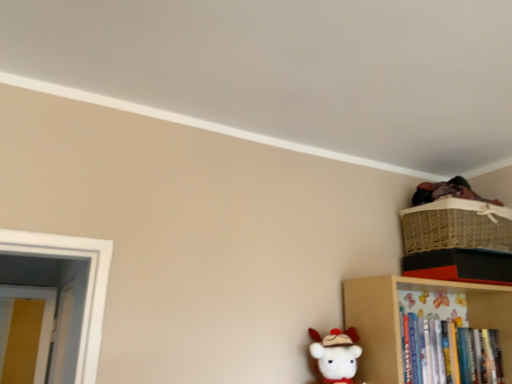
Question: Is woven straw basket at upper right positioned with its back to white plush toy at lower center?

Choices:
 (A) no
 (B) yes

Answer: (A)

Question: Considering the relative sizes of woven straw basket at upper right and white plush toy at lower center in the image provided, is woven straw basket at upper right shorter than white plush toy at lower center?

Choices:
 (A) no
 (B) yes

Answer: (B)

Question: Does woven straw basket at upper right have a smaller size compared to white plush toy at lower center?

Choices:
 (A) yes
 (B) no

Answer: (B)

Question: Can you confirm if woven straw basket at upper right is wider than white plush toy at lower center?

Choices:
 (A) no
 (B) yes

Answer: (B)

Question: From the image's perspective, is woven straw basket at upper right over white plush toy at lower center?

Choices:
 (A) no
 (B) yes

Answer: (B)

Question: Could you tell me if woven straw basket at upper right is turned towards white plush toy at lower center?

Choices:
 (A) yes
 (B) no

Answer: (B)

Question: Could you tell me if wooden bookshelf at lower right is turned towards white plush toy at lower center?

Choices:
 (A) no
 (B) yes

Answer: (A)

Question: Is wooden bookshelf at lower right not close to white plush toy at lower center?

Choices:
 (A) no
 (B) yes

Answer: (A)

Question: Does wooden bookshelf at lower right have a smaller size compared to white plush toy at lower center?

Choices:
 (A) yes
 (B) no

Answer: (B)

Question: From a real-world perspective, is wooden bookshelf at lower right on top of white plush toy at lower center?

Choices:
 (A) yes
 (B) no

Answer: (A)

Question: Does wooden bookshelf at lower right have a larger size compared to white plush toy at lower center?

Choices:
 (A) yes
 (B) no

Answer: (A)

Question: Can you confirm if wooden bookshelf at lower right is taller than white plush toy at lower center?

Choices:
 (A) no
 (B) yes

Answer: (B)

Question: Does wooden bookshelf at lower right lie behind woven straw basket at upper right?

Choices:
 (A) yes
 (B) no

Answer: (B)